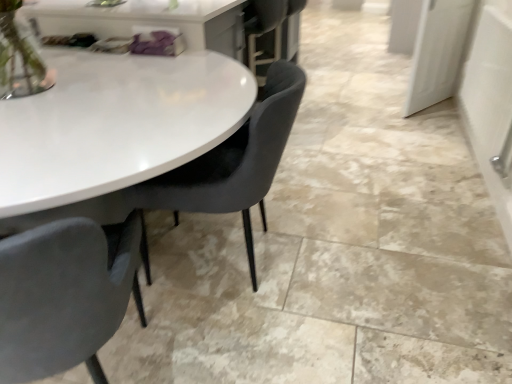
In order to click on empty space that is in between white glossy door at upper right and matte black chair at center, acting as the 2th chair starting from the left in this screenshot , I will do `click(349, 173)`.